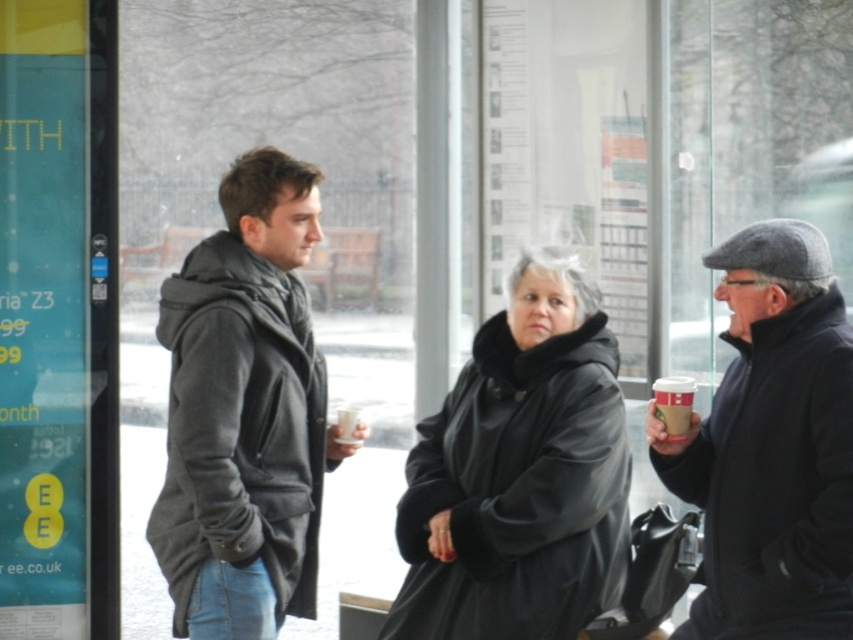
Question: Does black leather coat at center come in front of white paper cup at right?

Choices:
 (A) yes
 (B) no

Answer: (A)

Question: Does black leather coat at center have a larger size compared to dark gray wool coat at center?

Choices:
 (A) yes
 (B) no

Answer: (A)

Question: Among these objects, which one is nearest to the camera?

Choices:
 (A) matte black coat at center
 (B) black leather coat at center
 (C) white paper cup at right

Answer: (A)

Question: Does white paper cup at right appear on the right side of white paper cup at center?

Choices:
 (A) yes
 (B) no

Answer: (A)

Question: Which object is the farthest from the white paper cup at right?

Choices:
 (A) dark gray wool coat at center
 (B) black leather coat at center
 (C) matte black coat at center

Answer: (A)

Question: Estimate the real-world distances between objects in this image. Which object is farther from the white paper cup at right?

Choices:
 (A) dark gray wool coat at center
 (B) white paper cup at center

Answer: (A)